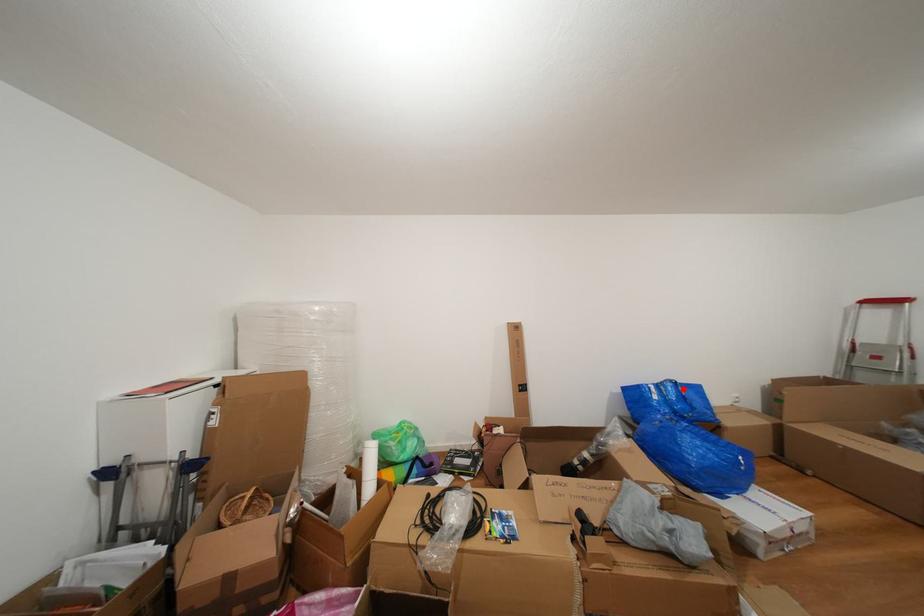
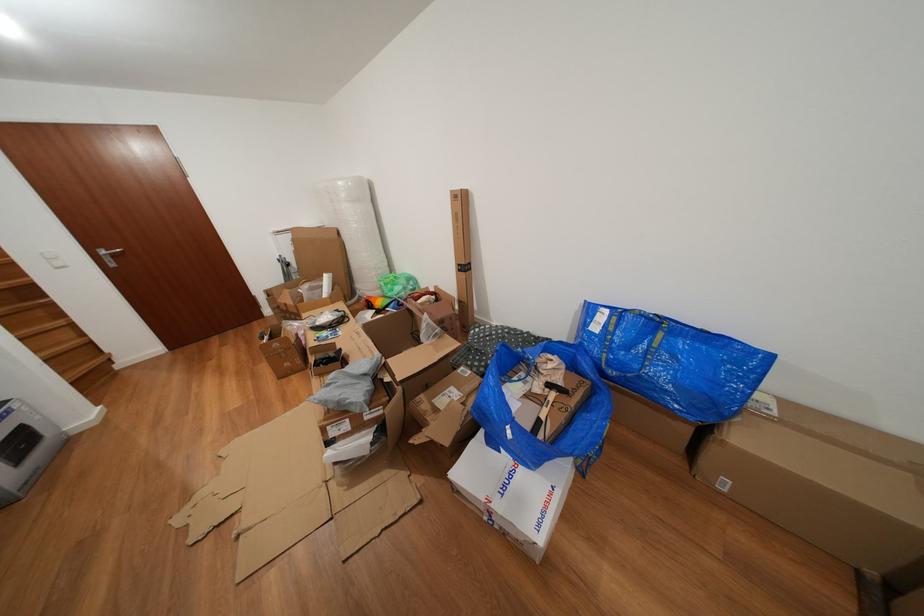
Where in the second image is the point corresponding to the highlighted location from the first image?

(663, 328)